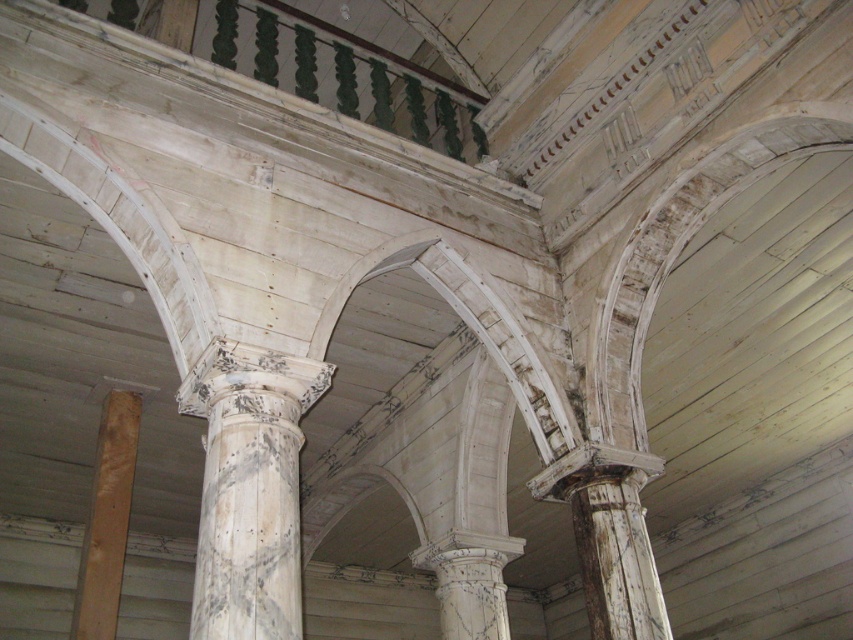
Question: Which point is farther from the camera taking this photo?

Choices:
 (A) (112, 602)
 (B) (190, 624)

Answer: (A)

Question: Considering the relative positions of white weathered column at center and light brown wood at lower left in the image provided, where is white weathered column at center located with respect to light brown wood at lower left?

Choices:
 (A) right
 (B) left

Answer: (A)

Question: Can you confirm if white weathered column at center is positioned to the right of light brown wood at lower left?

Choices:
 (A) no
 (B) yes

Answer: (B)

Question: Can you confirm if white weathered column at center is positioned to the right of light brown wood at lower left?

Choices:
 (A) no
 (B) yes

Answer: (B)

Question: Among these points, which one is nearest to the camera?

Choices:
 (A) (207, 412)
 (B) (115, 552)

Answer: (A)